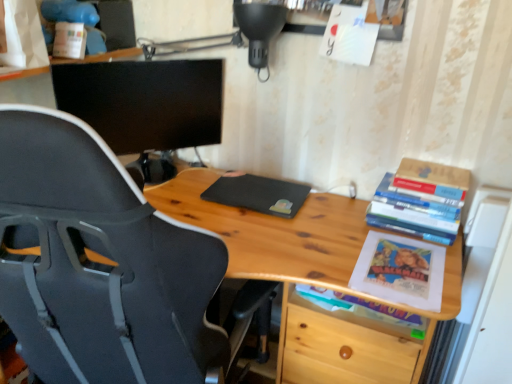
The image size is (512, 384). In order to click on blank space to the left of black matte laptop at center in this screenshot , I will do `click(187, 190)`.